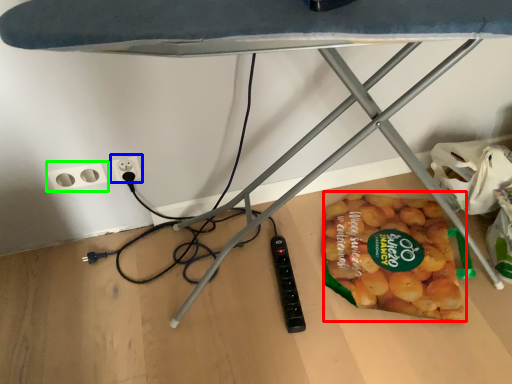
Question: Based on their relative distances, which object is farther from snack (highlighted by a red box)? Choose from electric outlet (highlighted by a blue box) and socket (highlighted by a green box).

Choices:
 (A) electric outlet
 (B) socket

Answer: (B)